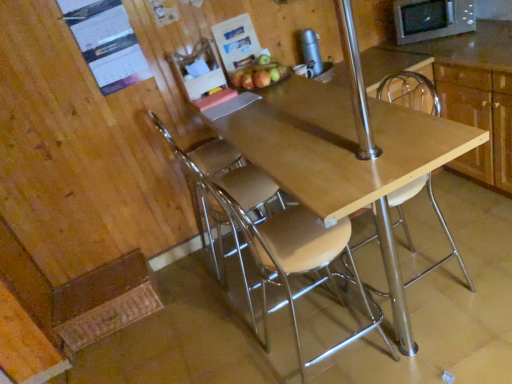
You are a GUI agent. You are given a task and a screenshot of the screen. Output one action in this format:
    pyautogui.click(x=<x>, y=<y>)
    Task: Click on the free area in between light brown wood chair at center, acting as the 3th chair starting from the left, and wooden seat at center, which appears as the 2th chair when viewed from the right
    
    Given the screenshot: What is the action you would take?
    pyautogui.click(x=380, y=318)